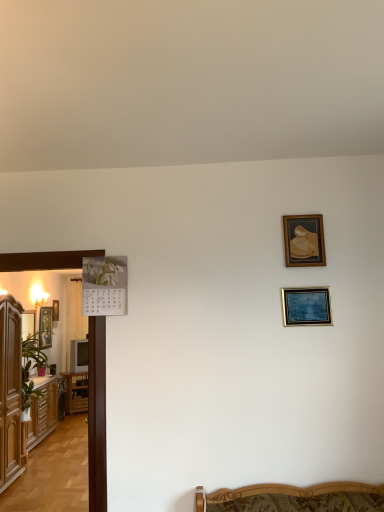
Question: Can you confirm if gold-framed picture at left, marked as the fifth picture frame in a right-to-left arrangement, is smaller than gold-framed portrait at left, marked as the third picture frame in a right-to-left arrangement?

Choices:
 (A) no
 (B) yes

Answer: (B)

Question: Is gold-framed portrait at left, placed as the fourth picture frame when sorted from front to back, inside gold-framed picture at left, marked as the fifth picture frame in a right-to-left arrangement?

Choices:
 (A) no
 (B) yes

Answer: (A)

Question: Is gold-framed picture at left, which is the 1th picture frame in left-to-right order, facing towards gold-framed portrait at left, marked as the third picture frame in a right-to-left arrangement?

Choices:
 (A) yes
 (B) no

Answer: (B)

Question: Is gold-framed picture at left, placed as the first picture frame when sorted from back to front, at the right side of gold-framed portrait at left, marked as the third picture frame in a right-to-left arrangement?

Choices:
 (A) no
 (B) yes

Answer: (A)

Question: Considering the relative sizes of gold-framed picture at left, placed as the first picture frame when sorted from back to front, and gold-framed portrait at left, marked as the third picture frame in a right-to-left arrangement, in the image provided, is gold-framed picture at left, placed as the first picture frame when sorted from back to front, thinner than gold-framed portrait at left, marked as the third picture frame in a right-to-left arrangement,?

Choices:
 (A) yes
 (B) no

Answer: (A)

Question: Relative to brown wooden table at left, is matte wooden picture frame at left, which is the 3th picture frame in front-to-back order, in front or behind?

Choices:
 (A) front
 (B) behind

Answer: (A)

Question: From a real-world perspective, is matte wooden picture frame at left, which is counted as the third picture frame, starting from the back, positioned above or below brown wooden table at left?

Choices:
 (A) below
 (B) above

Answer: (B)

Question: From the image's perspective, relative to brown wooden table at left, is matte wooden picture frame at left, which is counted as the third picture frame, starting from the back, above or below?

Choices:
 (A) below
 (B) above

Answer: (B)

Question: Is matte wooden picture frame at left, the fourth picture frame positioned from the right, taller or shorter than brown wooden table at left?

Choices:
 (A) tall
 (B) short

Answer: (A)

Question: In terms of height, does gold-framed picture at upper right, the second picture frame when ordered from front to back, look taller or shorter compared to metallic silver picture frame at center right, the 2th picture frame positioned from the right?

Choices:
 (A) short
 (B) tall

Answer: (B)

Question: From a real-world perspective, is gold-framed picture at upper right, which is the first picture frame from right to left, physically located above or below metallic silver picture frame at center right, the 2th picture frame positioned from the right?

Choices:
 (A) below
 (B) above

Answer: (B)

Question: Which is correct: gold-framed picture at upper right, which is the first picture frame from right to left, is inside metallic silver picture frame at center right, marked as the 4th picture frame in a left-to-right arrangement, or outside of it?

Choices:
 (A) inside
 (B) outside

Answer: (B)

Question: Is point (291, 257) positioned closer to the camera than point (311, 301)?

Choices:
 (A) farther
 (B) closer

Answer: (A)

Question: From the image's perspective, is brown wood cabinet at left, which is the 2th cabinetry in back-to-front order, above or below wooden cabinet at left, which is the 1th cabinetry in back-to-front order?

Choices:
 (A) above
 (B) below

Answer: (A)

Question: Is brown wood cabinet at left, acting as the 1th cabinetry starting from the front, spatially inside wooden cabinet at left, which is the second cabinetry in front-to-back order, or outside of it?

Choices:
 (A) outside
 (B) inside

Answer: (A)